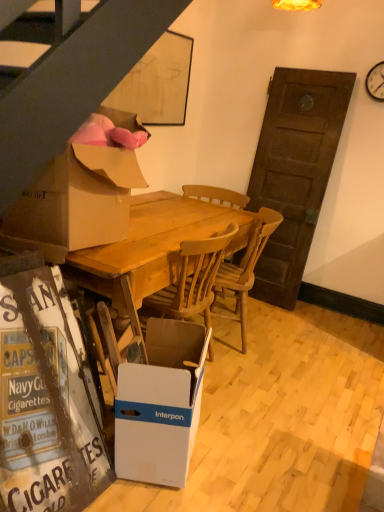
Question: From the image's perspective, would you say wooden chair at center is shown under cardboard box at left, the 2th box from the bottom?

Choices:
 (A) no
 (B) yes

Answer: (B)

Question: Considering the relative positions of wooden chair at center and cardboard box at left, the 1th box in the top-to-bottom sequence, in the image provided, is wooden chair at center behind cardboard box at left, the 1th box in the top-to-bottom sequence,?

Choices:
 (A) no
 (B) yes

Answer: (B)

Question: Is there a large distance between wooden chair at center and cardboard box at left, the 2th box from the bottom?

Choices:
 (A) no
 (B) yes

Answer: (B)

Question: Can you confirm if wooden chair at center is positioned to the left of cardboard box at left, the 2th box from the bottom?

Choices:
 (A) yes
 (B) no

Answer: (B)

Question: Is wooden chair at center looking in the opposite direction of cardboard box at left, the 2th box from the bottom?

Choices:
 (A) yes
 (B) no

Answer: (B)

Question: Which is correct: wooden chair at center is inside white cardboard box at lower center, acting as the first box starting from the bottom, or outside of it?

Choices:
 (A) inside
 (B) outside

Answer: (B)

Question: From the image's perspective, is wooden chair at center located above or below white cardboard box at lower center, the 2th box positioned from the top?

Choices:
 (A) below
 (B) above

Answer: (B)

Question: From their relative heights in the image, would you say wooden chair at center is taller or shorter than white cardboard box at lower center, acting as the first box starting from the bottom?

Choices:
 (A) short
 (B) tall

Answer: (B)

Question: From a real-world perspective, is wooden chair at center physically located above or below white cardboard box at lower center, the 2th box positioned from the top?

Choices:
 (A) below
 (B) above

Answer: (B)

Question: From the image's perspective, relative to cardboard box at left, the 2th box from the bottom, is white cardboard at lower left above or below?

Choices:
 (A) above
 (B) below

Answer: (B)

Question: Considering the positions of point (31, 450) and point (72, 188), is point (31, 450) closer or farther from the camera than point (72, 188)?

Choices:
 (A) closer
 (B) farther

Answer: (A)

Question: In terms of height, does white cardboard at lower left look taller or shorter compared to cardboard box at left, the 1th box in the top-to-bottom sequence?

Choices:
 (A) short
 (B) tall

Answer: (B)

Question: Is white cardboard at lower left situated inside cardboard box at left, the 2th box from the bottom, or outside?

Choices:
 (A) outside
 (B) inside

Answer: (A)

Question: Would you say wooden table at center is to the left or to the right of white plastic clock at upper right in the picture?

Choices:
 (A) left
 (B) right

Answer: (A)

Question: Relative to white plastic clock at upper right, is wooden table at center in front or behind?

Choices:
 (A) behind
 (B) front

Answer: (B)